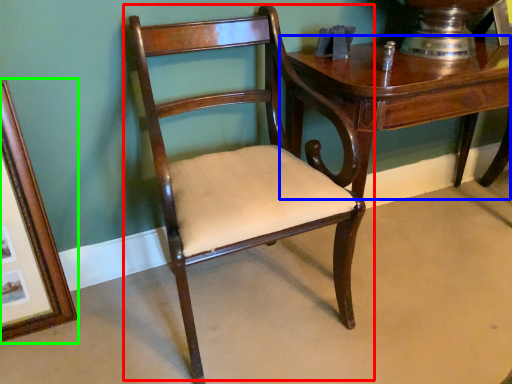
Question: Which object is positioned farthest from chair (highlighted by a red box)? Select from table (highlighted by a blue box) and picture frame (highlighted by a green box).

Choices:
 (A) table
 (B) picture frame

Answer: (B)